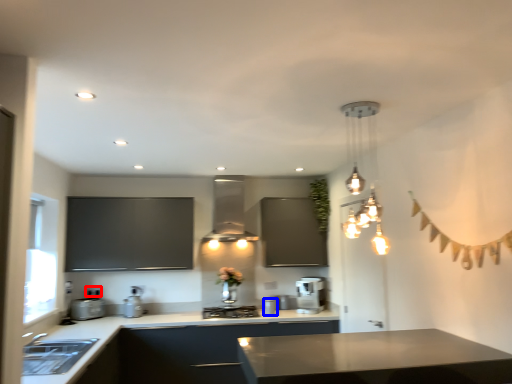
Question: Which object appears farthest to the camera in this image, electric outlet (highlighted by a red box) or appliance (highlighted by a blue box)?

Choices:
 (A) electric outlet
 (B) appliance

Answer: (A)